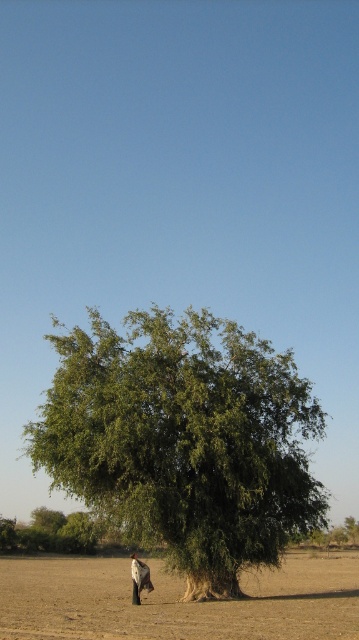
Question: Among these points, which one is nearest to the camera?

Choices:
 (A) (140, 582)
 (B) (338, 621)

Answer: (B)

Question: Which of these objects is positioned closest to the green leafy tree at center?

Choices:
 (A) dark brown fur at lower center
 (B) brown sandy dirt at lower center

Answer: (A)

Question: Is green leafy tree at center smaller than brown sandy dirt at lower center?

Choices:
 (A) yes
 (B) no

Answer: (A)

Question: Does green leafy tree at center appear over dark brown fur at lower center?

Choices:
 (A) yes
 (B) no

Answer: (A)

Question: Is green leafy tree at center thinner than dark brown fur at lower center?

Choices:
 (A) yes
 (B) no

Answer: (B)

Question: Which of these objects is positioned farthest from the green leafy tree at center?

Choices:
 (A) brown sandy dirt at lower center
 (B) dark brown fur at lower center

Answer: (A)